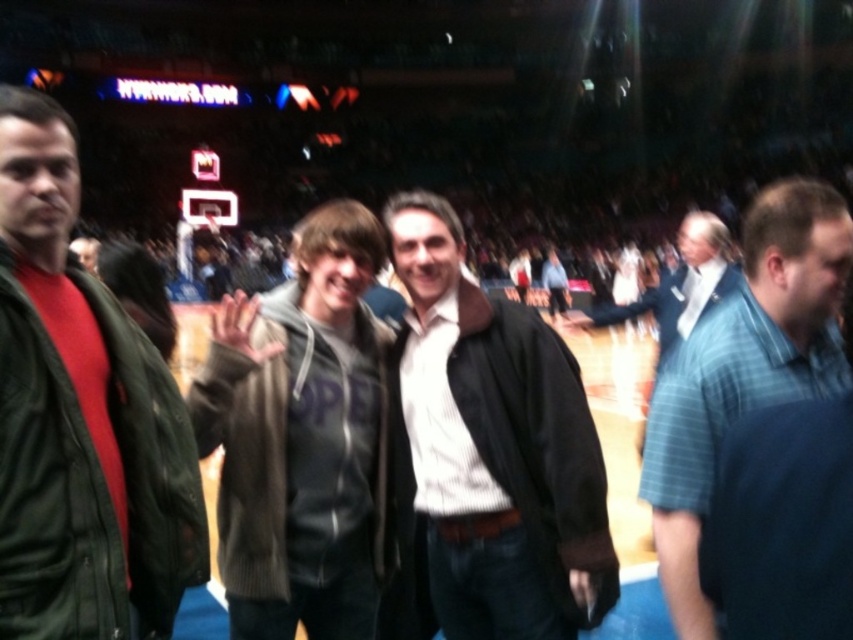
You are a photographer who wants to take a clear photo of the gray hoodie at center and the blue plaid shirt at right. Since the background is blurry, can you focus on both people without moving the camera?

The blue plaid shirt at right is behind the gray hoodie at center, so they are at different distances from the camera. To focus on both clearly, the photographer would need to adjust the camera settings for a deeper depth of field or move closer to ensure both are in the same focal plane.

You are standing in the basketball arena and see the matte black jacket at center and the gray hoodie at center. Which one is positioned to the right?

The matte black jacket at center is positioned to the right of the gray hoodie at center.